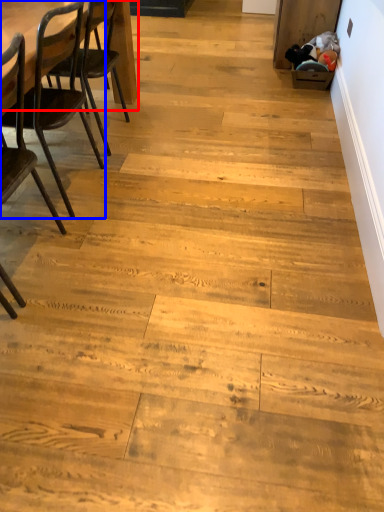
Question: Which object is further to the camera taking this photo, table (highlighted by a red box) or chair (highlighted by a blue box)?

Choices:
 (A) table
 (B) chair

Answer: (A)